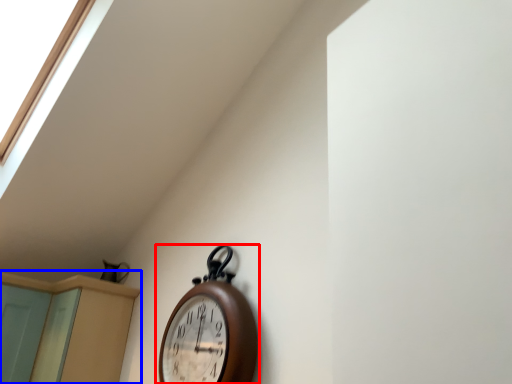
Question: Which of the following is the closest to the observer, wall clock (highlighted by a red box) or dresser (highlighted by a blue box)?

Choices:
 (A) wall clock
 (B) dresser

Answer: (A)